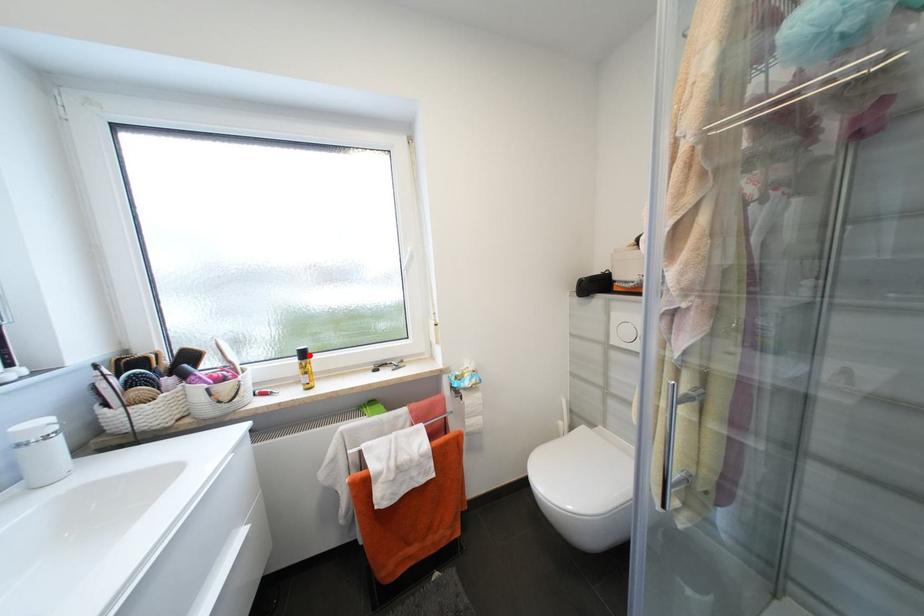
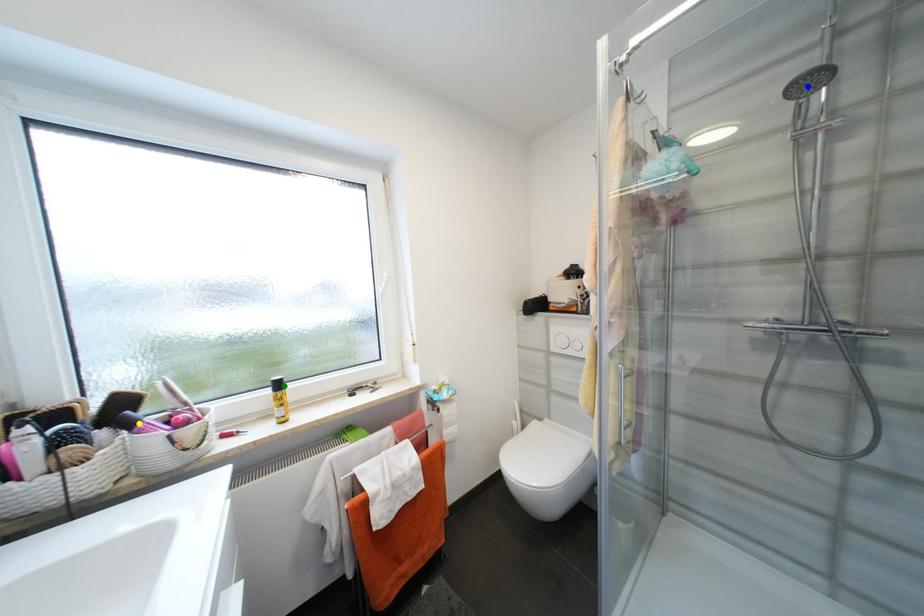
Question: I am providing you with two images of the same scene from different viewpoints. A red point is marked on the first image. You are given multiple points on the second image. Which point in image 2 represents the same 3d spot as the red point in image 1?

Choices:
 (A) blue point
 (B) green point
 (C) yellow point

Answer: (B)